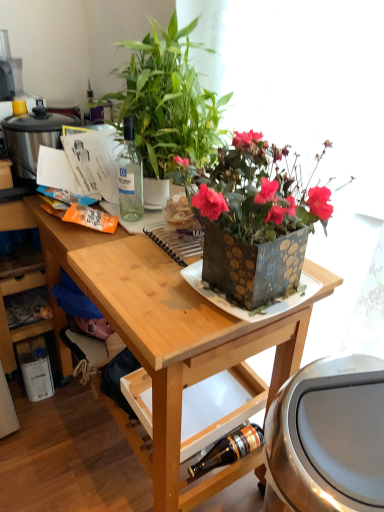
The width and height of the screenshot is (384, 512). Identify the location of free space above wooden desk at center (from a real-world perspective). (136, 243).